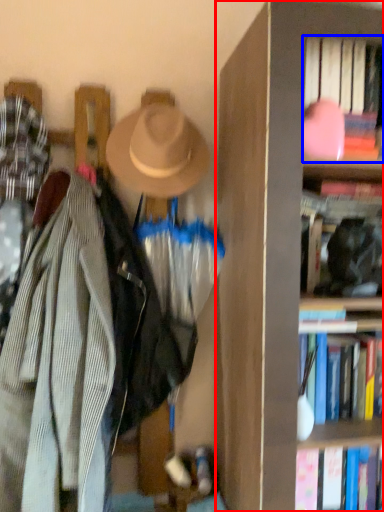
Question: Which of the following is the farthest to the observer, bookcase (highlighted by a red box) or book (highlighted by a blue box)?

Choices:
 (A) bookcase
 (B) book

Answer: (B)